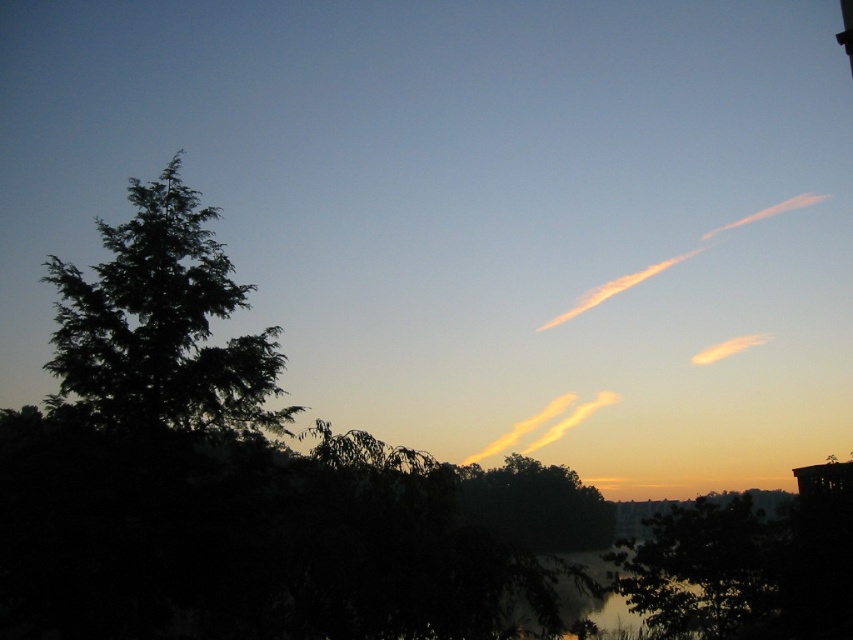
Question: Which point is farther from the camera taking this photo?

Choices:
 (A) pyautogui.click(x=515, y=438)
 (B) pyautogui.click(x=91, y=380)

Answer: (A)

Question: Can you confirm if glossy reflective water at lower center is thinner than translucent orange cloud at upper right?

Choices:
 (A) no
 (B) yes

Answer: (A)

Question: Does pastel pink cotton cloud at upper right have a larger size compared to translucent orange cloud at center?

Choices:
 (A) yes
 (B) no

Answer: (A)

Question: Which point is farther from the camera taking this photo?

Choices:
 (A) pyautogui.click(x=601, y=616)
 (B) pyautogui.click(x=84, y=352)

Answer: (A)

Question: Can you confirm if glossy reflective water at lower center is thinner than pastel pink cotton cloud at upper right?

Choices:
 (A) yes
 (B) no

Answer: (A)

Question: Which point appears farthest from the camera in this image?

Choices:
 (A) (x=795, y=205)
 (B) (x=73, y=337)
 (C) (x=737, y=346)
 (D) (x=572, y=422)

Answer: (A)